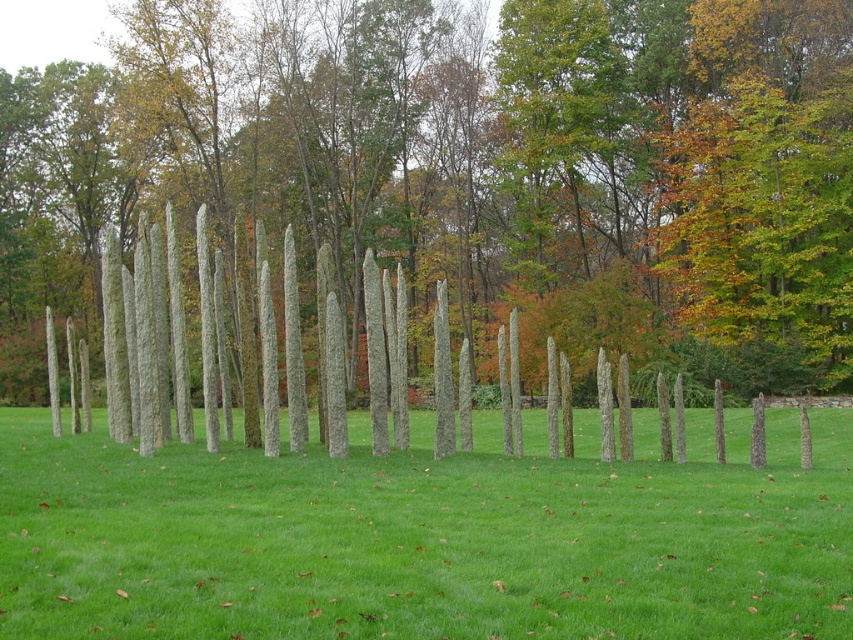
Is smooth gray pole at center taller than green grass at center?

Indeed, smooth gray pole at center has a greater height compared to green grass at center.

Is smooth gray pole at center bigger than green grass at center?

Indeed, smooth gray pole at center has a larger size compared to green grass at center.

What do you see at coordinates (465, 170) in the screenshot?
I see `smooth gray pole at center` at bounding box center [465, 170].

Locate an element on the screen. smooth gray pole at center is located at coordinates (465, 170).